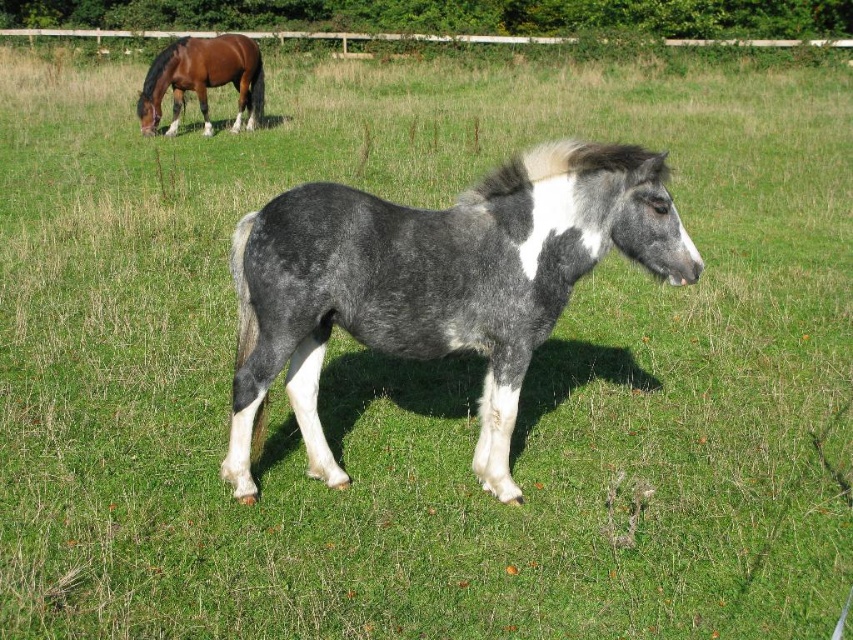
Does gray speckled coat at center have a lesser height compared to gray woolen tail at lower center?

In fact, gray speckled coat at center may be taller than gray woolen tail at lower center.

Is point (352, 205) less distant than point (245, 340)?

Yes, it is in front of point (245, 340).

What do you see at coordinates (436, 284) in the screenshot?
I see `gray speckled coat at center` at bounding box center [436, 284].

The image size is (853, 640). I want to click on gray speckled coat at center, so click(436, 284).

Which is above, gray speckled coat at center or brown glossy horse at upper left?

brown glossy horse at upper left is higher up.

Who is more distant from viewer, [339,205] or [148,106]?

The point [148,106] is more distant.

Locate an element on the screen. The image size is (853, 640). gray speckled coat at center is located at coordinates (436, 284).

Between brown glossy horse at upper left and gray woolen tail at lower center, which one appears on the left side from the viewer's perspective?

From the viewer's perspective, brown glossy horse at upper left appears more on the left side.

Does brown glossy horse at upper left have a larger size compared to gray woolen tail at lower center?

Yes.

Is point (212, 72) farther from viewer compared to point (233, 368)?

Yes, it is behind point (233, 368).

Locate an element on the screen. brown glossy horse at upper left is located at coordinates (202, 80).